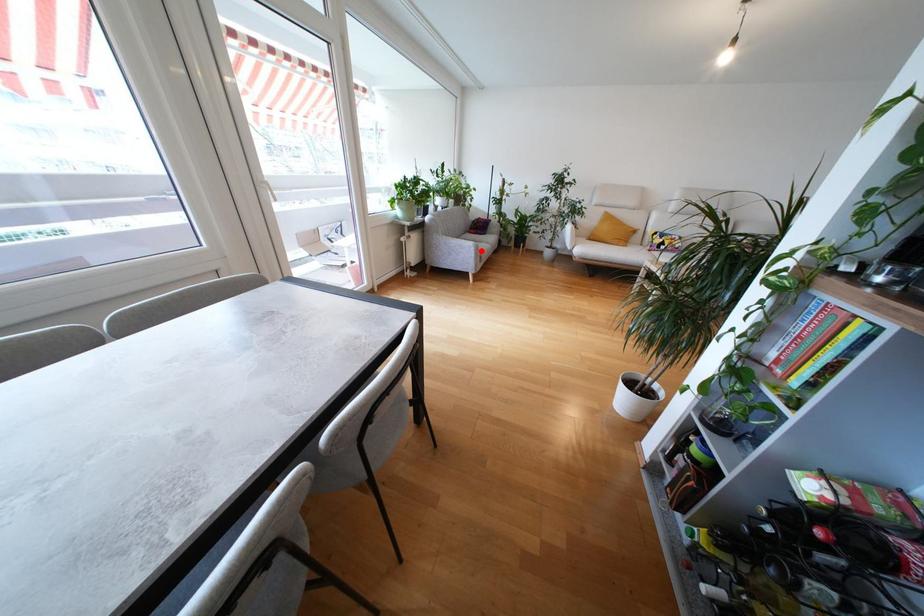
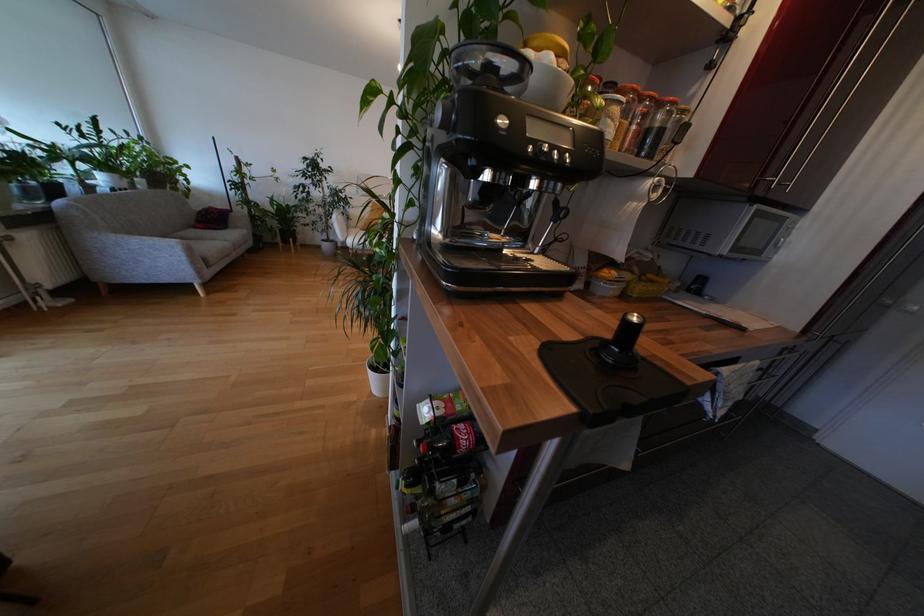
Where in the second image is the point corresponding to the highlighted location from the first image?

(192, 252)